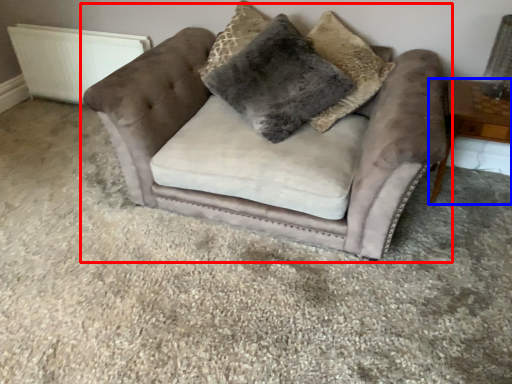
Question: Which of the following is the farthest to the observer, chair (highlighted by a red box) or table (highlighted by a blue box)?

Choices:
 (A) chair
 (B) table

Answer: (B)